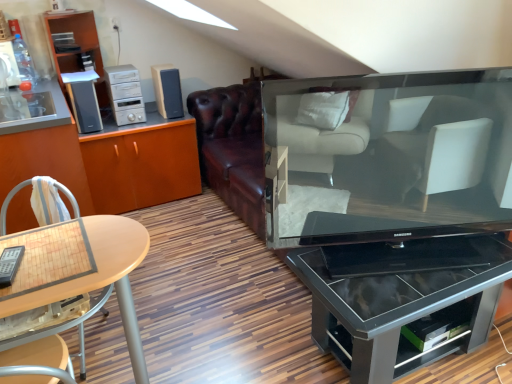
Where is `free space on the front side of silver metallic stereo at upper left, which is the 2th appliance from left to right`? free space on the front side of silver metallic stereo at upper left, which is the 2th appliance from left to right is located at coordinates (120, 129).